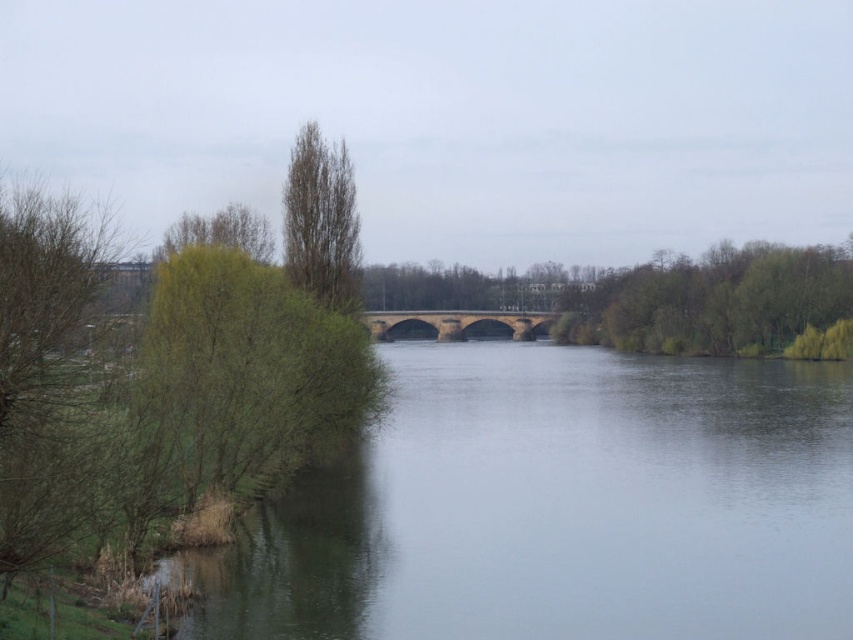
You are standing on the stone bridge in the center of the image. Looking towards the green leafy tree at upper right, can you see the clear water at center behind it?

The clear water at center is in front of the green leafy tree at upper right, so you cannot see the clear water at center behind the green leafy tree at upper right.

You are an artist standing at the riverside and want to paint the green leafy tree at upper right and the brown textured tree at upper center. Which tree appears closer to you in the scene?

The green leafy tree at upper right appears closer to you than the brown textured tree at upper center because it is further to the viewer in the scene.